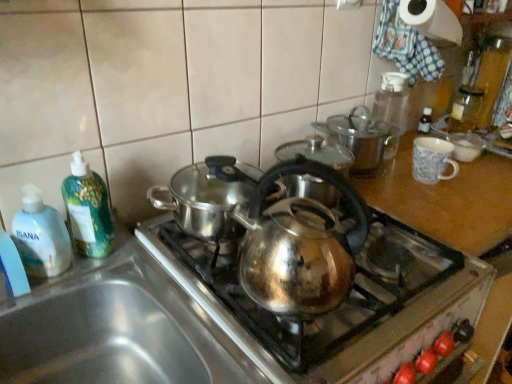
Question: Is shiny metallic kettle at center bigger than transparent glass bottle at upper right, which is the 4th bottle in left-to-right order?

Choices:
 (A) yes
 (B) no

Answer: (A)

Question: Is shiny metallic kettle at center next to transparent glass bottle at upper right, which is the 4th bottle in left-to-right order?

Choices:
 (A) yes
 (B) no

Answer: (B)

Question: Is shiny metallic kettle at center taller than transparent glass bottle at upper right, which appears as the fourth bottle when viewed from the front?

Choices:
 (A) yes
 (B) no

Answer: (A)

Question: Is shiny metallic kettle at center not within transparent glass bottle at upper right, the 1th bottle in the right-to-left sequence?

Choices:
 (A) yes
 (B) no

Answer: (A)

Question: Is shiny metallic kettle at center aimed at transparent glass bottle at upper right, the 1th bottle in the right-to-left sequence?

Choices:
 (A) yes
 (B) no

Answer: (B)

Question: Visually, is transparent plastic bottle at upper right, which appears as the second bottle when viewed from the back, positioned to the left or to the right of shiny metallic pot at upper center?

Choices:
 (A) left
 (B) right

Answer: (B)

Question: Does point (395, 120) appear closer or farther from the camera than point (338, 115)?

Choices:
 (A) farther
 (B) closer

Answer: (A)

Question: In terms of height, does transparent plastic bottle at upper right, which appears as the second bottle when viewed from the back, look taller or shorter compared to shiny metallic pot at upper center?

Choices:
 (A) tall
 (B) short

Answer: (A)

Question: Based on their sizes in the image, would you say transparent plastic bottle at upper right, which ranks as the 2th bottle in right-to-left order, is bigger or smaller than shiny metallic pot at upper center?

Choices:
 (A) big
 (B) small

Answer: (B)

Question: In terms of height, does transparent plastic bottle at upper right, which ranks as the 2th bottle in right-to-left order, look taller or shorter compared to white paper towel at upper right?

Choices:
 (A) tall
 (B) short

Answer: (A)

Question: Looking at the image, does transparent plastic bottle at upper right, which is the third bottle from left to right, seem bigger or smaller compared to white paper towel at upper right?

Choices:
 (A) big
 (B) small

Answer: (B)

Question: From a real-world perspective, is transparent plastic bottle at upper right, which is the third bottle from left to right, physically located above or below white paper towel at upper right?

Choices:
 (A) below
 (B) above

Answer: (A)

Question: Looking at their shapes, would you say transparent plastic bottle at upper right, which ranks as the 2th bottle in right-to-left order, is wider or thinner than white paper towel at upper right?

Choices:
 (A) thin
 (B) wide

Answer: (B)

Question: From a real-world perspective, relative to green plastic bottle at left, the 3th bottle in the right-to-left sequence, is transparent plastic bottle at upper right, the third bottle positioned from the front, vertically above or below?

Choices:
 (A) below
 (B) above

Answer: (B)

Question: Considering the relative positions of transparent plastic bottle at upper right, which ranks as the 2th bottle in right-to-left order, and green plastic bottle at left, the 3th bottle in the right-to-left sequence, in the image provided, is transparent plastic bottle at upper right, which ranks as the 2th bottle in right-to-left order, to the left or to the right of green plastic bottle at left, the 3th bottle in the right-to-left sequence,?

Choices:
 (A) left
 (B) right

Answer: (B)